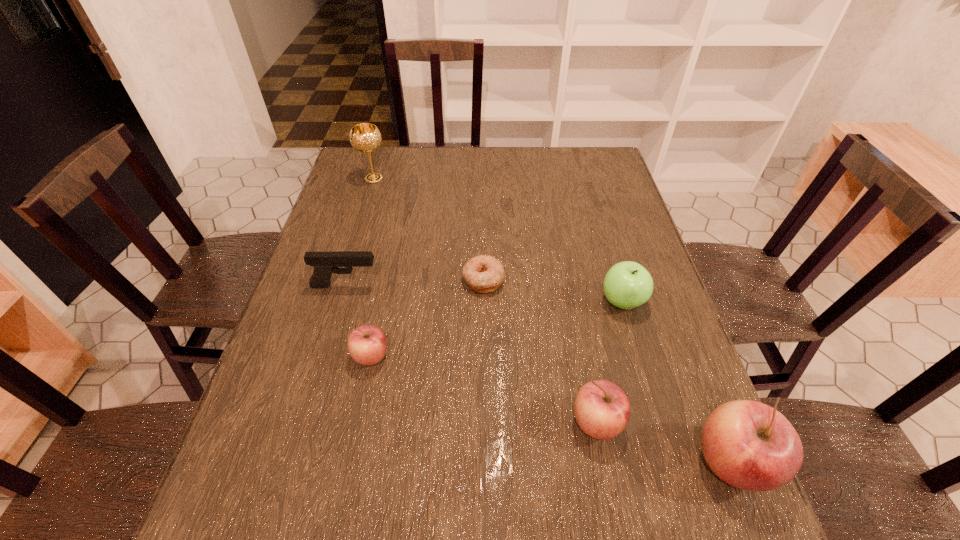
Image resolution: width=960 pixels, height=540 pixels. I want to click on object that is at the near right corner, so click(x=749, y=445).

Locate an element on the screen. Image resolution: width=960 pixels, height=540 pixels. vacant region at the far edge is located at coordinates [x=455, y=157].

I want to click on free space at the left edge of the desktop, so [298, 375].

Locate an element on the screen. blank space at the right edge is located at coordinates (610, 225).

Find the location of a particular element. Image resolution: width=960 pixels, height=540 pixels. free space at the far left corner of the desktop is located at coordinates (350, 154).

The image size is (960, 540). I want to click on blank space at the far right corner, so pos(602,160).

In the image, there is a desktop. Where is `vacant space at the near right corner`? The image size is (960, 540). vacant space at the near right corner is located at coordinates (681, 446).

You are a GUI agent. You are given a task and a screenshot of the screen. Output one action in this format:
    pyautogui.click(x=<x>, y=<y>)
    Task: Click on the unoccupied area between the shortest object and the tallest apple
    This screenshot has width=960, height=540.
    Given the screenshot: What is the action you would take?
    pyautogui.click(x=608, y=371)

Locate an element on the screen. empty location between the tallest apple and the farthest apple is located at coordinates (677, 382).

Identify the location of free area in between the pistol and the shortest object. (415, 282).